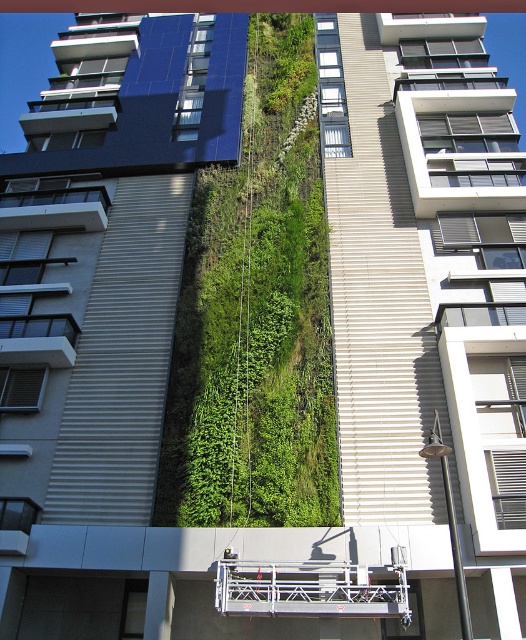
From the picture: You are an architect reviewing the building design. You need to install a new light fixture between the green leafy plant at center and the blue glossy solar panel at upper left. Based on their positions, on which side of the solar panel should you place the light fixture?

The green leafy plant at center is positioned on the right side of the blue glossy solar panel at upper left, so the light fixture should be placed to the right of the blue glossy solar panel at upper left to maintain symmetry between the two objects.

Based on the photo, you are an architect evaluating the building design. You notice the green leafy plant at center and the blue glossy solar panel at upper left. Which of these two elements takes up more space on the building facade?

The blue glossy solar panel at upper left takes up more space than the green leafy plant at center.

You are a maintenance worker needing to access the blue glossy solar panel at upper left for inspection. The green leafy plant at center is in the way. Which direction should you move the plant to clear the path?

The green leafy plant at center is located below the blue glossy solar panel at upper left. To clear the path, you should move the plant downward away from the panel.